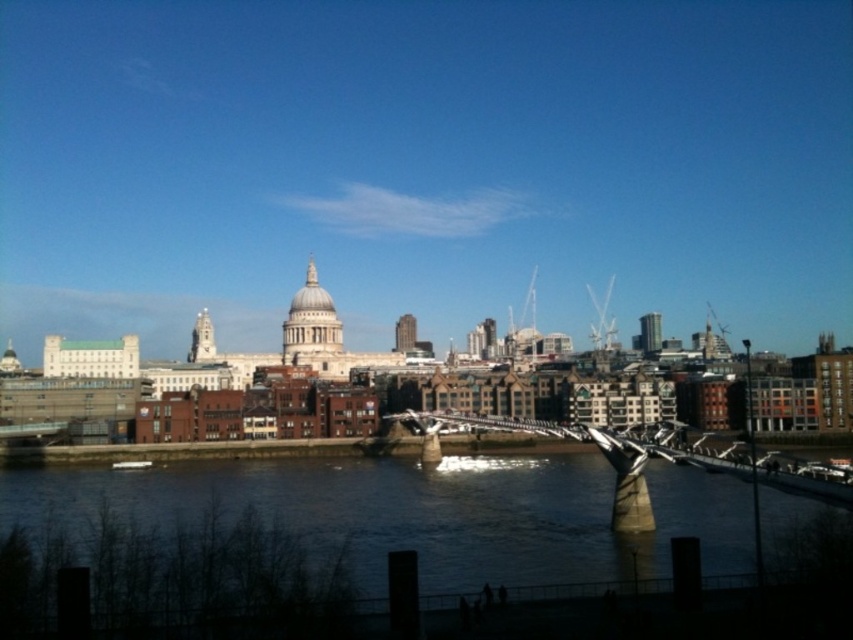
Can you confirm if dark water at center is taller than metallic silver bridge at center?

In fact, dark water at center may be shorter than metallic silver bridge at center.

In the scene shown: Can you confirm if dark water at center is positioned to the right of metallic silver bridge at center?

No, dark water at center is not to the right of metallic silver bridge at center.

In order to click on dark water at center in this screenshot , I will do `click(426, 513)`.

Image resolution: width=853 pixels, height=640 pixels. What are the coordinates of `dark water at center` in the screenshot? It's located at (426, 513).